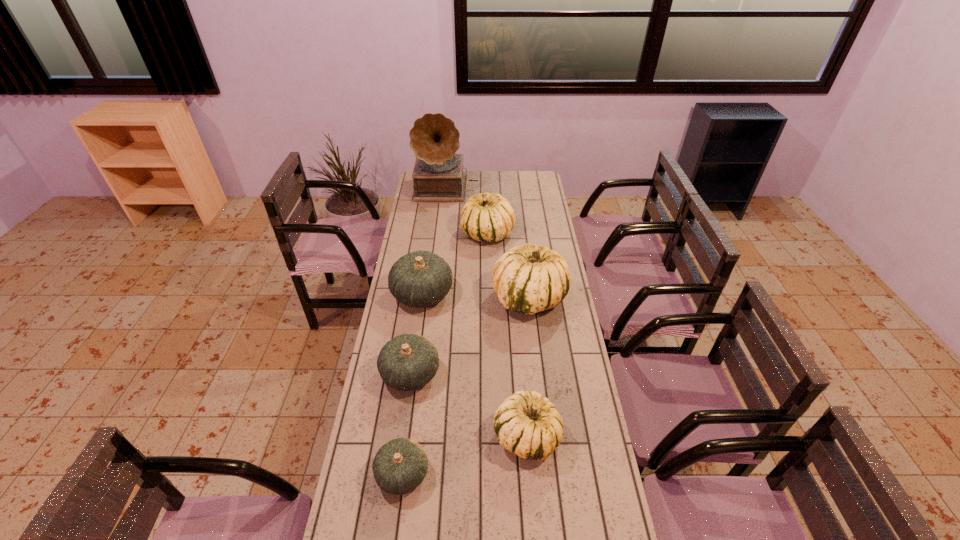
Locate an element on the screen. The image size is (960, 540). the tallest object is located at coordinates click(x=438, y=177).

Identify the location of record player. This screenshot has height=540, width=960. click(438, 177).

Identify the location of the biggest white gourd. (528, 278).

Identify the location of the biggest orange gourd. (419, 279).

The width and height of the screenshot is (960, 540). I want to click on the second farthest object, so click(x=490, y=217).

Identify the location of the farthest white gourd. (490, 217).

I want to click on the second biggest orange gourd, so click(x=408, y=362).

Identify the location of the second nearest orange gourd. This screenshot has width=960, height=540. (408, 362).

Locate an element on the screen. Image resolution: width=960 pixels, height=540 pixels. the nearest white gourd is located at coordinates (526, 423).

This screenshot has width=960, height=540. I want to click on the shortest gourd, so click(400, 466).